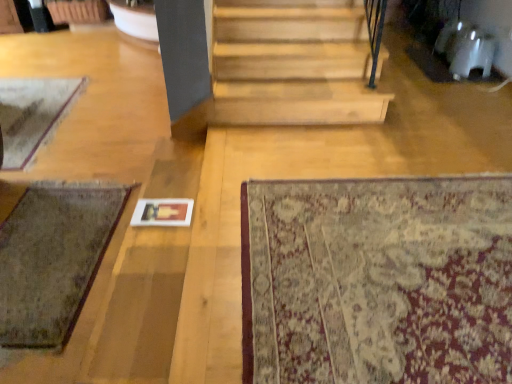
Question: Is worn wool mat at lower left, acting as the 3th mat starting from the front, situated inside beige floral rug at lower right, acting as the 1th mat starting from the front, or outside?

Choices:
 (A) inside
 (B) outside

Answer: (B)

Question: In terms of height, does worn wool mat at lower left, acting as the first mat starting from the left, look taller or shorter compared to beige floral rug at lower right, which is counted as the 3th mat, starting from the back?

Choices:
 (A) tall
 (B) short

Answer: (A)

Question: Which is nearer to the beige floral rug at lower right, which is counted as the 3th mat, starting from the back?

Choices:
 (A) worn wool mat at lower left, acting as the first mat starting from the left
 (B) green woolen mat at lower left, which is the second mat from front to back

Answer: (B)

Question: Which of these objects is positioned farthest from the beige floral rug at lower right, acting as the 1th mat starting from the front?

Choices:
 (A) green woolen mat at lower left, acting as the second mat starting from the right
 (B) worn wool mat at lower left, the first mat positioned from the back

Answer: (B)